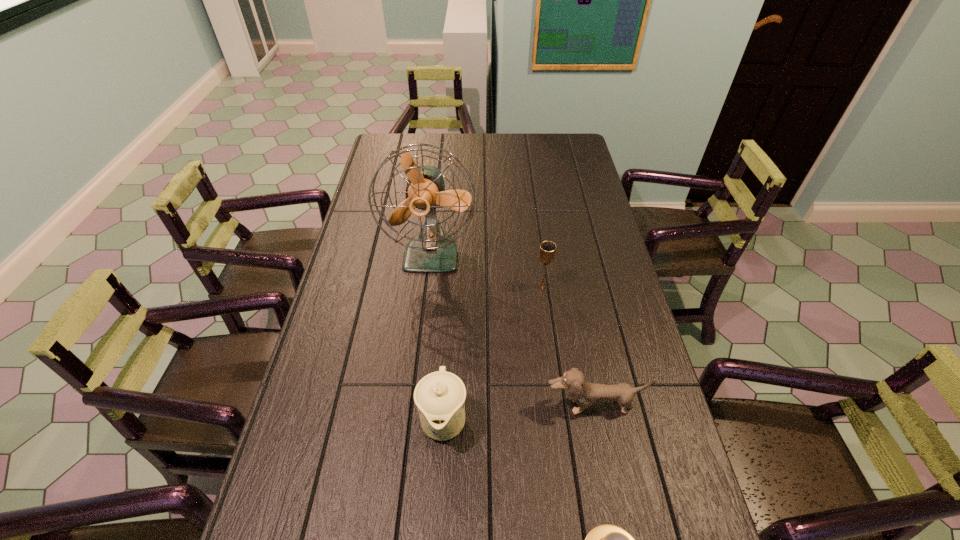
This screenshot has height=540, width=960. I want to click on free space between the fan and the fourth tallest object, so click(x=513, y=330).

Find the location of a particular element. The height and width of the screenshot is (540, 960). free space between the fourth tallest object and the chalice is located at coordinates (567, 346).

Locate an element on the screen. vacant area between the chalice and the fan is located at coordinates click(x=487, y=271).

Find the location of a particular element. The width and height of the screenshot is (960, 540). object that stands as the fourth closest to the shortest object is located at coordinates (431, 250).

Select which object is the fourth closest to the chinaware. Please provide its 2D coordinates. Your answer should be formatted as a tuple, i.e. [(x, y)], where the tuple contains the x and y coordinates of a point satisfying the conditions above.

[(547, 251)]